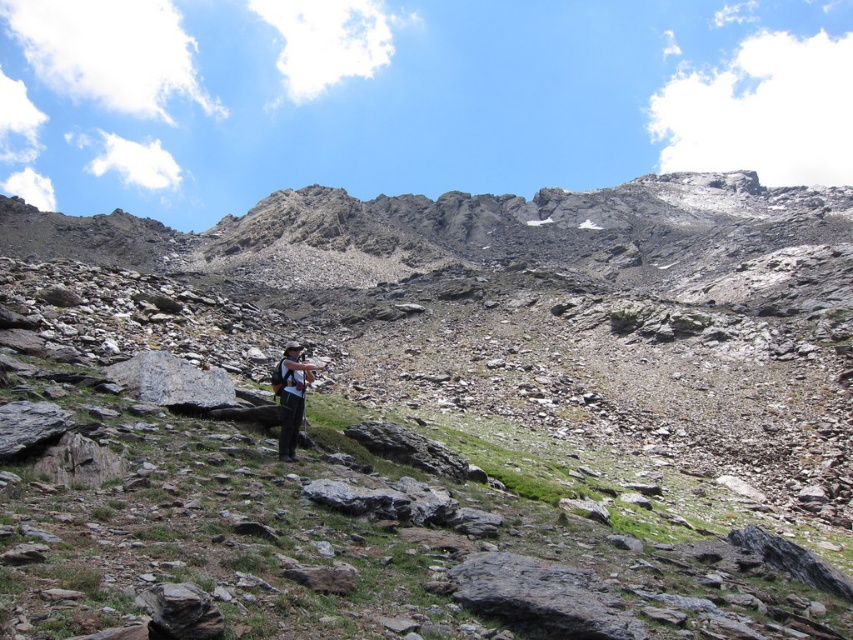
Does gray rocky mountain at center appear on the left side of matte black backpack at center?

Incorrect, gray rocky mountain at center is not on the left side of matte black backpack at center.

Can you confirm if gray rocky mountain at center is positioned above matte black backpack at center?

Correct, gray rocky mountain at center is located above matte black backpack at center.

The height and width of the screenshot is (640, 853). In order to click on gray rocky mountain at center in this screenshot , I will do `click(431, 410)`.

Identify the location of gray rocky mountain at center. This screenshot has width=853, height=640. (431, 410).